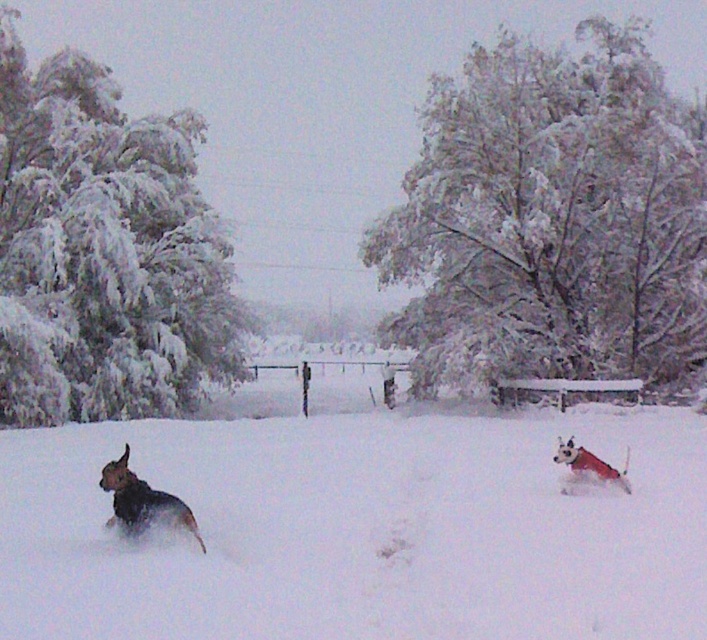
You are a photographer standing at the edge of the snowy field. You want to take a photo of the white fluffy snow at center and the white fur dog at lower right. If your camera has a focal length of 50mm, which object should you focus on to ensure both are in sharp focus? Explain your reasoning.

To ensure both the white fluffy snow at center and the white fur dog at lower right are in sharp focus with a 50mm lens, focus on the white fur dog at lower right. Since the white fluffy snow at center is 15.61 feet away from the dog, the hyperfocal distance calculation would allow both to be within the depth of field when focusing on the closer subject. The depth of field extends more behind the focused point than in front, so prioritizing the nearer object improves sharpness for both.